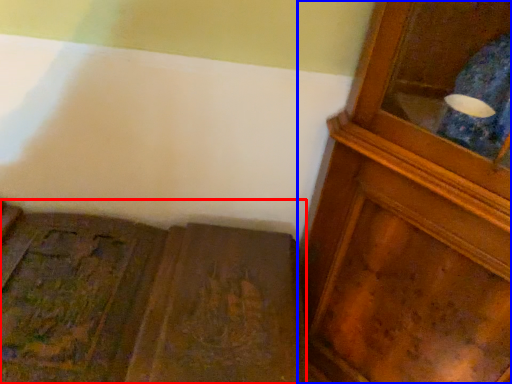
Question: Which of the following is the farthest to the observer, furniture (highlighted by a red box) or cupboard (highlighted by a blue box)?

Choices:
 (A) furniture
 (B) cupboard

Answer: (A)